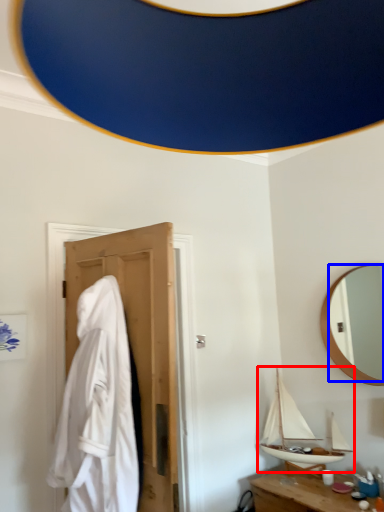
Question: Among these objects, which one is nearest to the camera, boat (highlighted by a red box) or mirror (highlighted by a blue box)?

Choices:
 (A) boat
 (B) mirror

Answer: (B)